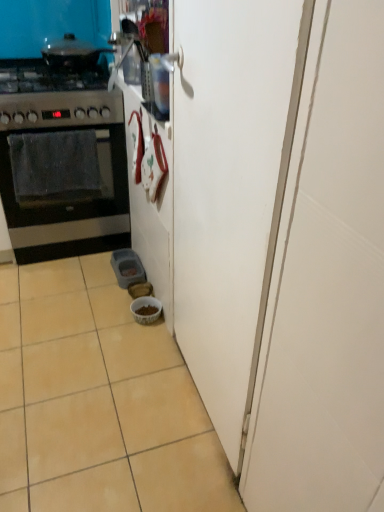
Locate an element on the screen. The image size is (384, 512). free location in front of white glossy bowl at lower center is located at coordinates (140, 342).